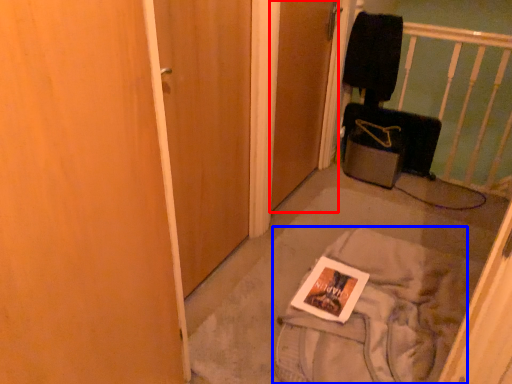
Question: Which of the following is the closest to the observer, door (highlighted by a red box) or material (highlighted by a blue box)?

Choices:
 (A) door
 (B) material

Answer: (B)